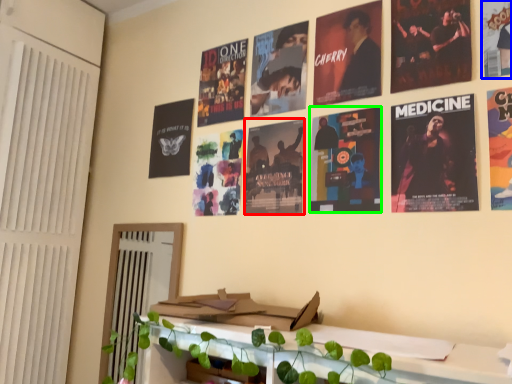
Question: Which object is the farthest from poster (highlighted by a red box)? Choose among these: poster (highlighted by a blue box) or poster (highlighted by a green box).

Choices:
 (A) poster
 (B) poster

Answer: (A)